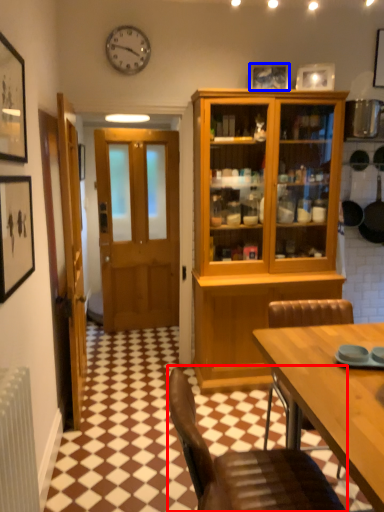
Question: Which object is closer to the camera taking this photo, chair (highlighted by a red box) or picture frame (highlighted by a blue box)?

Choices:
 (A) chair
 (B) picture frame

Answer: (A)